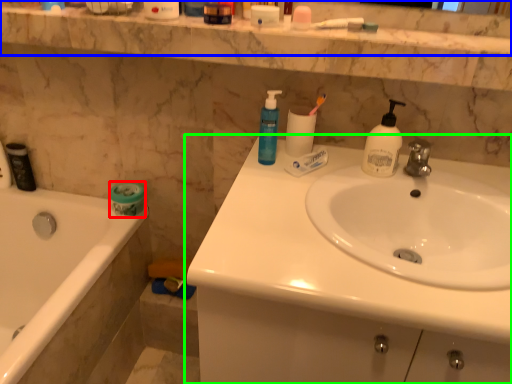
Question: Which object is positioned farthest from toilet paper (highlighted by a red box)? Select from balustrade (highlighted by a blue box) and sink (highlighted by a green box).

Choices:
 (A) balustrade
 (B) sink

Answer: (B)